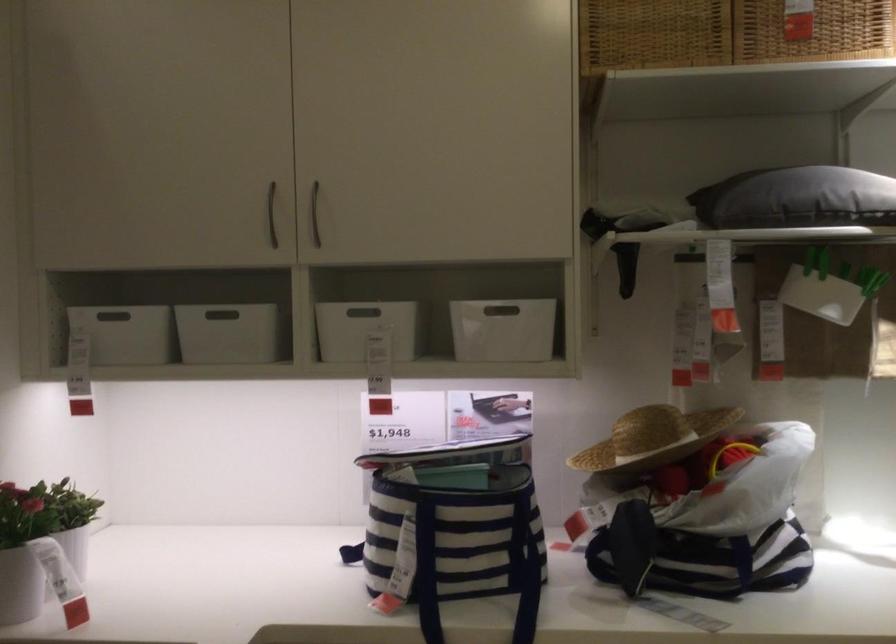
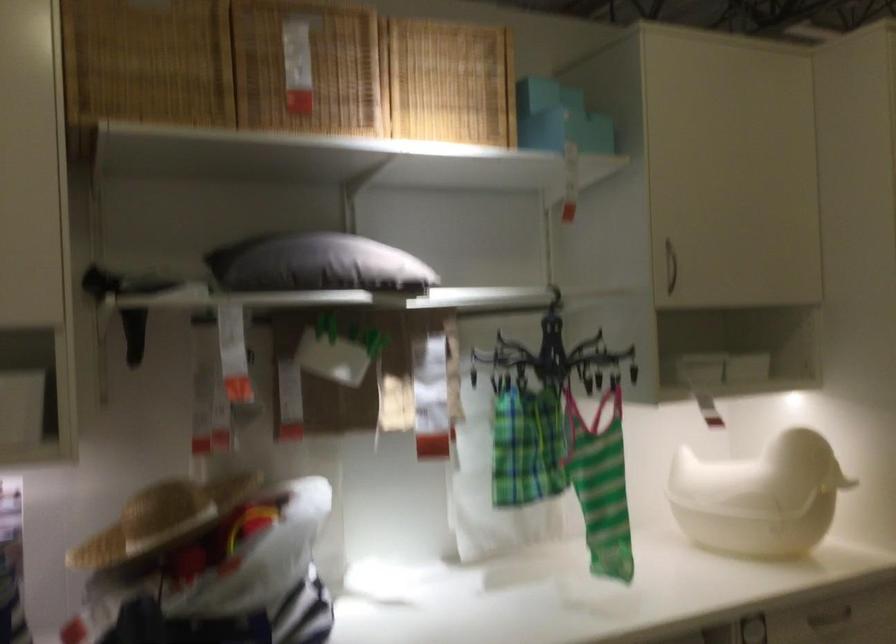
Find the pixel in the second image that matches point (648, 438) in the first image.

(161, 520)